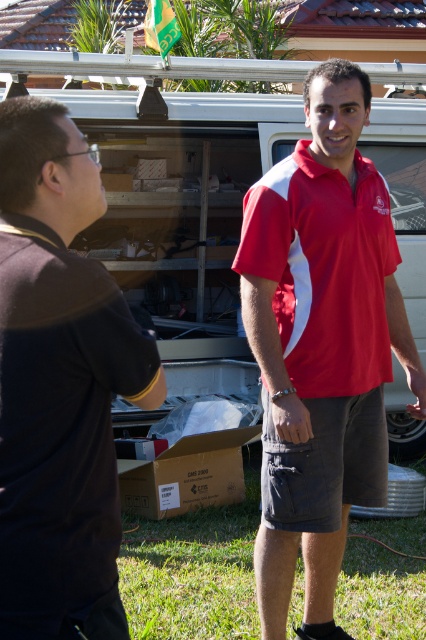
Is matte black truck at center positioned at the back of matte red polo shirt at center?

Yes, it is behind matte red polo shirt at center.

This screenshot has width=426, height=640. What do you see at coordinates (172, 166) in the screenshot?
I see `matte black truck at center` at bounding box center [172, 166].

Does point (417, 230) come in front of point (330, 342)?

No, it is behind (330, 342).

Where is `matte black truck at center`? matte black truck at center is located at coordinates (172, 166).

Identify the location of red matte shirt at center. This screenshot has width=426, height=640. (321, 344).

Is red matte shirt at center behind matte red polo shirt at center?

No, red matte shirt at center is in front of matte red polo shirt at center.

This screenshot has height=640, width=426. What do you see at coordinates (321, 344) in the screenshot?
I see `red matte shirt at center` at bounding box center [321, 344].

Where is `red matte shirt at center`? The width and height of the screenshot is (426, 640). red matte shirt at center is located at coordinates (321, 344).

Is red matte shirt at center closer to the viewer compared to matte black truck at center?

Yes.

Between red matte shirt at center and matte black truck at center, which one has more height?

red matte shirt at center is taller.

Who is more forward, (376, 316) or (204, 99)?

Positioned in front is point (376, 316).

The image size is (426, 640). Identify the location of red matte shirt at center. (321, 344).